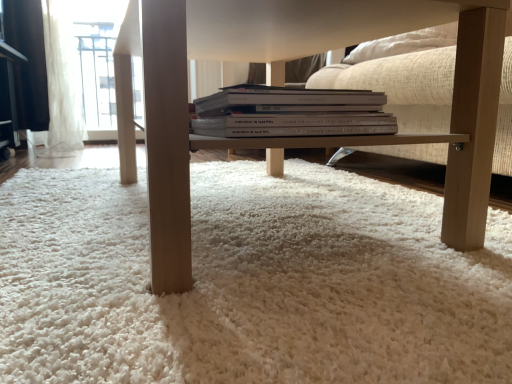
Question: Considering the relative sizes of white sheer curtain at upper left and white paper book at center in the image provided, is white sheer curtain at upper left thinner than white paper book at center?

Choices:
 (A) yes
 (B) no

Answer: (A)

Question: Is white sheer curtain at upper left looking in the opposite direction of white paper book at center?

Choices:
 (A) no
 (B) yes

Answer: (A)

Question: Does white sheer curtain at upper left lie in front of white paper book at center?

Choices:
 (A) no
 (B) yes

Answer: (A)

Question: Considering the relative sizes of white sheer curtain at upper left and white paper book at center in the image provided, is white sheer curtain at upper left shorter than white paper book at center?

Choices:
 (A) no
 (B) yes

Answer: (A)

Question: From a real-world perspective, is white sheer curtain at upper left located beneath white paper book at center?

Choices:
 (A) no
 (B) yes

Answer: (A)

Question: Relative to white sheer curtain at upper left, is light wood table at center in front or behind?

Choices:
 (A) behind
 (B) front

Answer: (B)

Question: From their relative heights in the image, would you say light wood table at center is taller or shorter than white sheer curtain at upper left?

Choices:
 (A) tall
 (B) short

Answer: (B)

Question: Would you say light wood table at center is to the left or to the right of white sheer curtain at upper left in the picture?

Choices:
 (A) right
 (B) left

Answer: (A)

Question: From a real-world perspective, is light wood table at center positioned above or below white sheer curtain at upper left?

Choices:
 (A) above
 (B) below

Answer: (B)

Question: Considering the positions of white paper book at center and white fluffy carpet at center in the image, is white paper book at center taller or shorter than white fluffy carpet at center?

Choices:
 (A) tall
 (B) short

Answer: (A)

Question: Looking at their shapes, would you say white paper book at center is wider or thinner than white fluffy carpet at center?

Choices:
 (A) wide
 (B) thin

Answer: (B)

Question: Is white paper book at center spatially inside white fluffy carpet at center, or outside of it?

Choices:
 (A) outside
 (B) inside

Answer: (A)

Question: Based on their sizes in the image, would you say white paper book at center is bigger or smaller than white fluffy carpet at center?

Choices:
 (A) small
 (B) big

Answer: (A)

Question: From a real-world perspective, is white sheer curtain at upper left above or below light wood table at center?

Choices:
 (A) below
 (B) above

Answer: (B)

Question: Considering the positions of white sheer curtain at upper left and light wood table at center in the image, is white sheer curtain at upper left taller or shorter than light wood table at center?

Choices:
 (A) short
 (B) tall

Answer: (B)